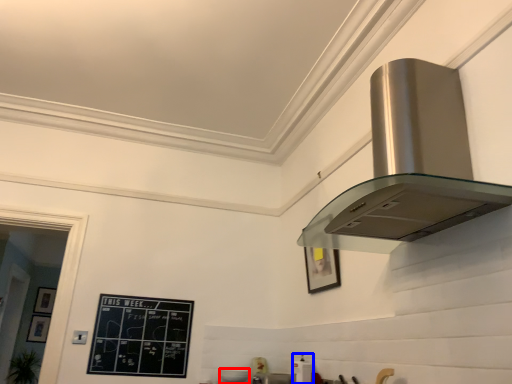
Question: Among these objects, which one is farthest to the camera, appliance (highlighted by a red box) or appliance (highlighted by a blue box)?

Choices:
 (A) appliance
 (B) appliance

Answer: (A)